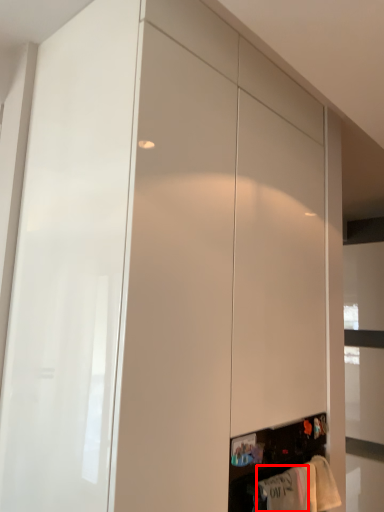
Question: From the image's perspective, considering the relative positions of clothing (annotated by the red box) and clothing in the image provided, where is clothing (annotated by the red box) located with respect to the staircase?

Choices:
 (A) above
 (B) below

Answer: (A)